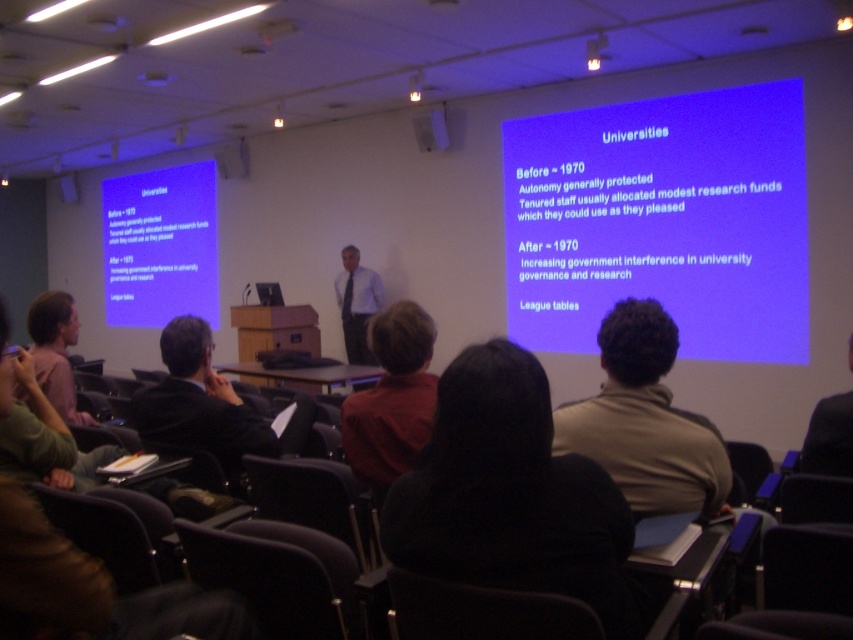
Is blue matte projection screen at upper left bigger than light brown hair at lower left?

Yes.

Is blue matte projection screen at upper left to the left of light brown hair at lower left from the viewer's perspective?

Indeed, blue matte projection screen at upper left is positioned on the left side of light brown hair at lower left.

Is point (115, 288) closer to viewer compared to point (57, 308)?

That is False.

Locate an element on the screen. This screenshot has height=640, width=853. blue matte projection screen at upper left is located at coordinates (160, 244).

Between point (683, 298) and point (36, 333), which one is positioned behind?

The point (683, 298) is more distant.

Does blue matte projection screen at upper right have a greater width compared to light brown hair at lower left?

Yes, blue matte projection screen at upper right is wider than light brown hair at lower left.

Measure the distance between point (737, 102) and camera.

The distance of point (737, 102) from camera is 18.55 feet.

Locate an element on the screen. The image size is (853, 640). blue matte projection screen at upper right is located at coordinates (662, 221).

Does blue matte projection screen at upper right appear on the right side of brown fleece jacket at center?

Yes, blue matte projection screen at upper right is to the right of brown fleece jacket at center.

Is blue matte projection screen at upper right thinner than brown fleece jacket at center?

No.

Is point (744, 307) more distant than point (637, 336)?

That is True.

This screenshot has height=640, width=853. Find the location of `blue matte projection screen at upper right`. blue matte projection screen at upper right is located at coordinates (662, 221).